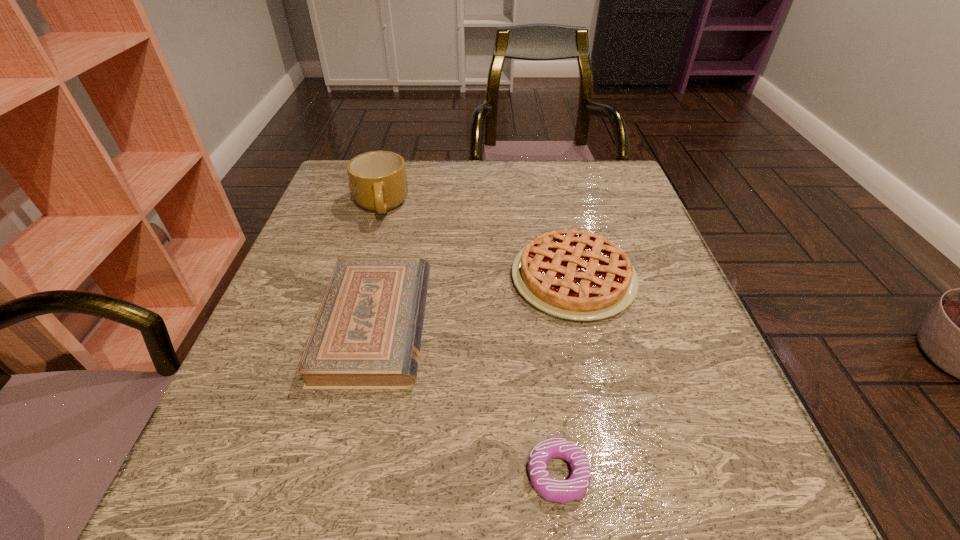
Image resolution: width=960 pixels, height=540 pixels. Find the location of `mug`. mug is located at coordinates pos(377,179).

Find the location of a particular element. the tallest object is located at coordinates (377, 179).

In order to click on pie in this screenshot , I will do click(x=572, y=274).

In order to click on Bible in this screenshot , I will do `click(367, 334)`.

This screenshot has height=540, width=960. I want to click on doughnut, so click(573, 488).

Locate an element on the screen. The height and width of the screenshot is (540, 960). the nearest object is located at coordinates (573, 488).

You are a GUI agent. You are given a task and a screenshot of the screen. Output one action in this format:
    pyautogui.click(x=<x>, y=<y>)
    Task: Click on the free region located 0.060m on the side with the handle of the farthest object
    
    Given the screenshot: What is the action you would take?
    pyautogui.click(x=370, y=245)

Image resolution: width=960 pixels, height=540 pixels. I want to click on vacant space located 0.150m on the front of the pie, so (600, 399).

This screenshot has height=540, width=960. In order to click on vacant space situated 0.060m on the spine side of the Bible in this screenshot , I will do point(458,325).

At what (x,y) coordinates should I click in order to perform the action: click on free space located on the left of the nearest object. Please return your answer as a coordinate pair (x, y). This screenshot has height=540, width=960. Looking at the image, I should click on (285, 474).